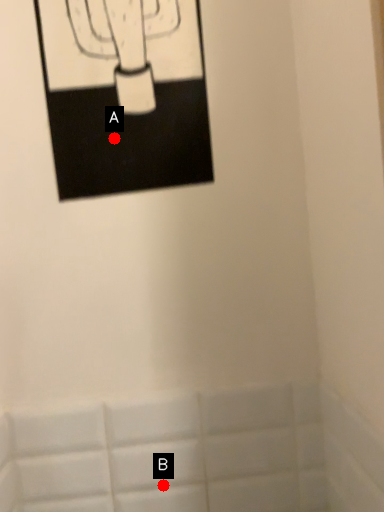
Question: Two points are circled on the image, labeled by A and B beside each circle. Which point is farther from the camera taking this photo?

Choices:
 (A) A is further
 (B) B is further

Answer: (B)